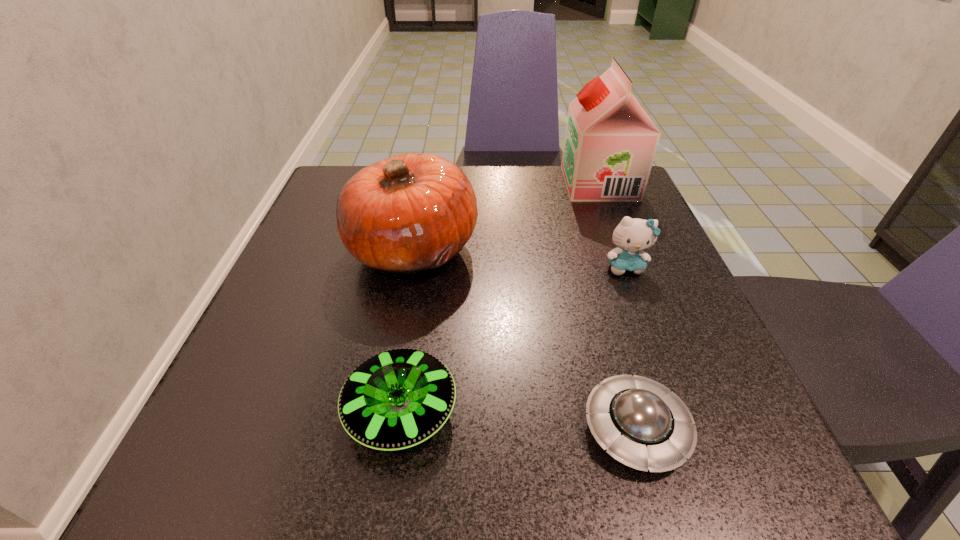
Find the location of `saucer situated at the right edge`. saucer situated at the right edge is located at coordinates (640, 423).

Locate an element on the screen. The height and width of the screenshot is (540, 960). object located at the far left corner is located at coordinates 406,214.

At what (x,y) coordinates should I click in order to perform the action: click on object at the far right corner. Please return your answer as a coordinate pair (x, y). Looking at the image, I should click on (610, 143).

This screenshot has height=540, width=960. I want to click on object that is at the near right corner, so click(x=640, y=423).

Locate an element on the screen. The width and height of the screenshot is (960, 540). free space at the far edge of the desktop is located at coordinates point(478,204).

Locate an element on the screen. vacant area at the near edge of the desktop is located at coordinates (570, 457).

The width and height of the screenshot is (960, 540). What are the coordinates of `free spot at the left edge of the desktop` in the screenshot? It's located at (305, 426).

The height and width of the screenshot is (540, 960). Identify the location of free space at the right edge of the desktop. (610, 221).

The height and width of the screenshot is (540, 960). Identify the location of vacant space at the near left corner. (215, 433).

The height and width of the screenshot is (540, 960). In order to click on free spot between the shorter saucer and the farthest object in this screenshot , I will do `click(617, 306)`.